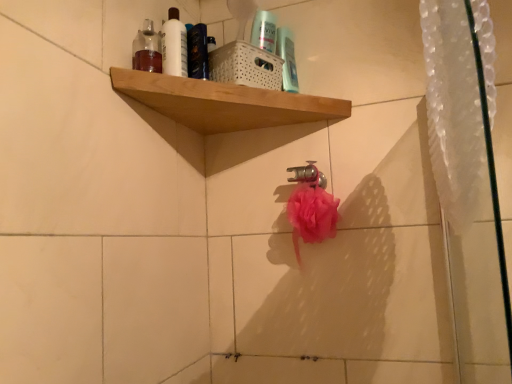
Question: Is the position of translucent plastic bottle at upper left less distant than that of wooden shelf at upper center?

Choices:
 (A) no
 (B) yes

Answer: (A)

Question: From a real-world perspective, is translucent plastic bottle at upper left positioned over wooden shelf at upper center based on gravity?

Choices:
 (A) no
 (B) yes

Answer: (B)

Question: Can you confirm if translucent plastic bottle at upper left is bigger than wooden shelf at upper center?

Choices:
 (A) no
 (B) yes

Answer: (A)

Question: Considering the relative sizes of translucent plastic bottle at upper left and wooden shelf at upper center in the image provided, is translucent plastic bottle at upper left thinner than wooden shelf at upper center?

Choices:
 (A) yes
 (B) no

Answer: (A)

Question: Is translucent plastic bottle at upper left at the right side of wooden shelf at upper center?

Choices:
 (A) no
 (B) yes

Answer: (A)

Question: From their relative heights in the image, would you say translucent plastic bottle at upper left is taller or shorter than white glossy bottle at upper center?

Choices:
 (A) short
 (B) tall

Answer: (A)

Question: From a real-world perspective, relative to white glossy bottle at upper center, is translucent plastic bottle at upper left vertically above or below?

Choices:
 (A) below
 (B) above

Answer: (A)

Question: Considering the positions of translucent plastic bottle at upper left and white glossy bottle at upper center in the image, is translucent plastic bottle at upper left wider or thinner than white glossy bottle at upper center?

Choices:
 (A) wide
 (B) thin

Answer: (A)

Question: In the image, is translucent plastic bottle at upper left on the left side or the right side of white glossy bottle at upper center?

Choices:
 (A) right
 (B) left

Answer: (B)

Question: Considering the relative positions of white glossy bottle at upper center and translucent plastic bottle at upper left in the image provided, is white glossy bottle at upper center to the left or to the right of translucent plastic bottle at upper left?

Choices:
 (A) right
 (B) left

Answer: (A)

Question: Considering the positions of white glossy bottle at upper center and translucent plastic bottle at upper left in the image, is white glossy bottle at upper center taller or shorter than translucent plastic bottle at upper left?

Choices:
 (A) tall
 (B) short

Answer: (A)

Question: Based on their sizes in the image, would you say white glossy bottle at upper center is bigger or smaller than translucent plastic bottle at upper left?

Choices:
 (A) big
 (B) small

Answer: (B)

Question: From a real-world perspective, is white glossy bottle at upper center above or below translucent plastic bottle at upper left?

Choices:
 (A) below
 (B) above

Answer: (B)

Question: Is wooden shelf at upper center inside or outside of white glossy bottle at upper center?

Choices:
 (A) inside
 (B) outside

Answer: (B)

Question: Considering the positions of wooden shelf at upper center and white glossy bottle at upper center in the image, is wooden shelf at upper center wider or thinner than white glossy bottle at upper center?

Choices:
 (A) thin
 (B) wide

Answer: (B)